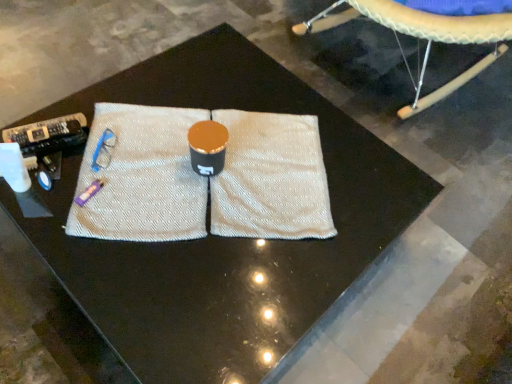
Identify the location of free space on the front side of white textured yoga mat at center. This screenshot has height=384, width=512. (138, 288).